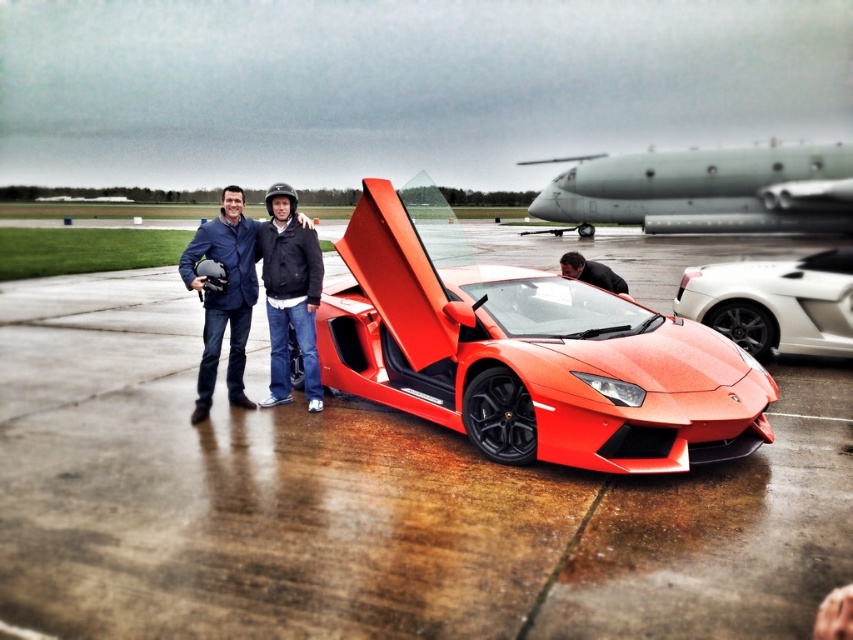
Can you confirm if glossy concrete tarmac at center is shorter than glossy orange sports car at center?

No, glossy concrete tarmac at center is not shorter than glossy orange sports car at center.

Is glossy concrete tarmac at center to the right of glossy orange sports car at center from the viewer's perspective?

In fact, glossy concrete tarmac at center is to the left of glossy orange sports car at center.

Is point (776, 532) positioned in front of point (656, 413)?

Yes.

Where is `glossy concrete tarmac at center`? The image size is (853, 640). glossy concrete tarmac at center is located at coordinates (370, 502).

The height and width of the screenshot is (640, 853). What are the coordinates of `matte blue jacket at center` in the screenshot? It's located at (223, 294).

Is point (244, 241) positioned in front of point (309, 344)?

Yes, it is.

This screenshot has width=853, height=640. In order to click on matte blue jacket at center in this screenshot , I will do `click(223, 294)`.

Can you confirm if glossy concrete tarmac at center is shorter than matte blue jacket at center?

Incorrect, glossy concrete tarmac at center's height does not fall short of matte blue jacket at center's.

Is point (84, 579) positioned in front of point (190, 416)?

Yes, it is in front of point (190, 416).

Is point (828, 396) farther from camera compared to point (258, 241)?

Yes, it is behind point (258, 241).

Where is `glossy concrete tarmac at center`? This screenshot has width=853, height=640. glossy concrete tarmac at center is located at coordinates (370, 502).